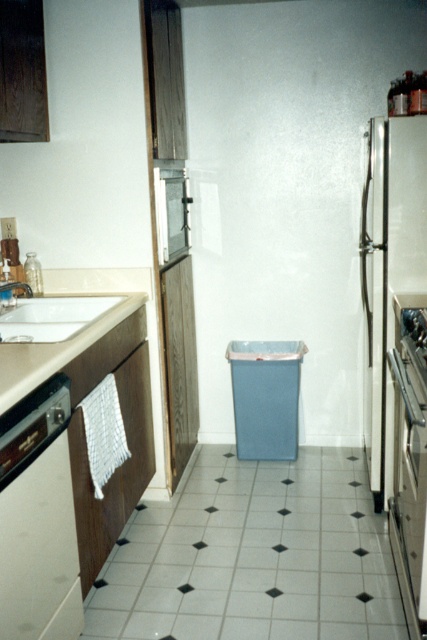
You are standing in the kitchen and want to place a small plant pot exactly at the center of the white tile at center. According to the image, what are the coordinates where you should place the plant pot?

The coordinates for the white tile at center are at point (253, 556), so you should place the plant pot at those coordinates.

You are organizing a kitchen layout and need to place a new appliance between the white glossy dishwasher at left and the satin silver oven at right. Given their sizes, which appliance should you place closer to the center of the kitchen?

Since the white glossy dishwasher at left is smaller than the satin silver oven at right, you should place the dishwasher closer to the center to balance the space between the two appliances.